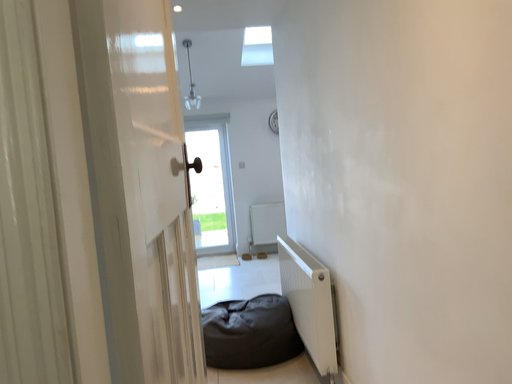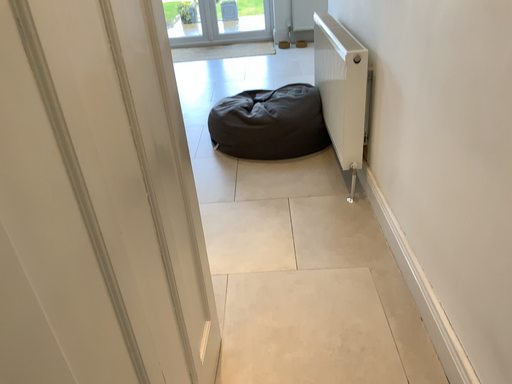
Question: Which way did the camera rotate in the video?

Choices:
 (A) rotated downward
 (B) rotated upward

Answer: (A)